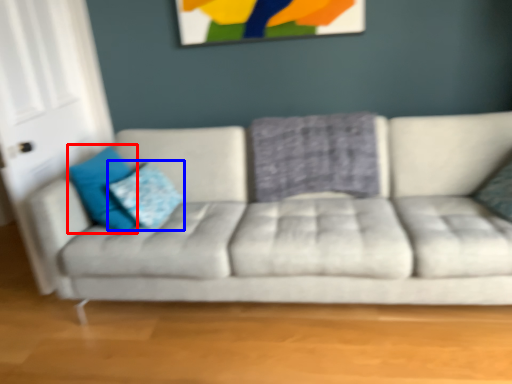
Question: Which point is closer to the camera, pillow (highlighted by a red box) or pillow (highlighted by a blue box)?

Choices:
 (A) pillow
 (B) pillow

Answer: (A)